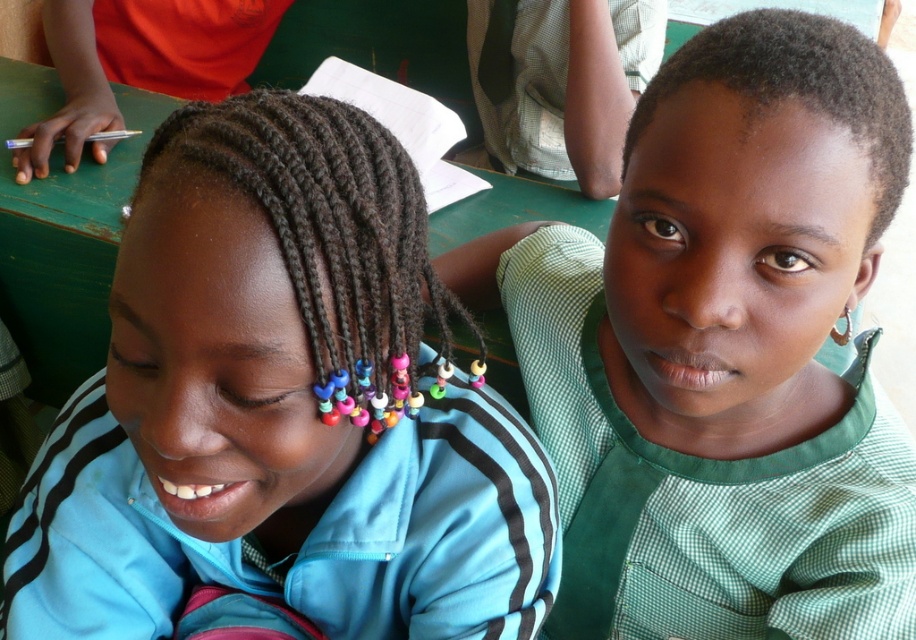
Can you confirm if blue fabric shirt at center is thinner than green checkered shirt at upper right?

Incorrect, blue fabric shirt at center's width is not less than green checkered shirt at upper right's.

Is point (127, 420) closer to camera compared to point (766, 240)?

No, (127, 420) is behind (766, 240).

Which is behind, point (442, 579) or point (740, 464)?

The point (740, 464) is behind.

Where is `blue fabric shirt at center`? blue fabric shirt at center is located at coordinates (281, 406).

Can you confirm if blue fabric shirt at center is thinner than multicolored beaded braids at center?

No.

Between point (230, 225) and point (337, 134), which one is positioned behind?

The point (337, 134) is behind.

Is point (358, 285) positioned after point (369, 396)?

No, (358, 285) is closer to viewer.

You are a GUI agent. You are given a task and a screenshot of the screen. Output one action in this format:
    pyautogui.click(x=<x>, y=<y>)
    Task: Click on the blue fabric shirt at center
    The image size is (916, 640).
    Given the screenshot: What is the action you would take?
    pyautogui.click(x=281, y=406)

Which of these two, green checkered shirt at upper right or multicolored beaded braids at center, stands shorter?

multicolored beaded braids at center is shorter.

Who is higher up, green checkered shirt at upper right or multicolored beaded braids at center?

Positioned higher is multicolored beaded braids at center.

Is point (795, 627) more distant than point (424, 308)?

No, it is in front of (424, 308).

Where is `green checkered shirt at upper right`? Image resolution: width=916 pixels, height=640 pixels. green checkered shirt at upper right is located at coordinates (722, 349).